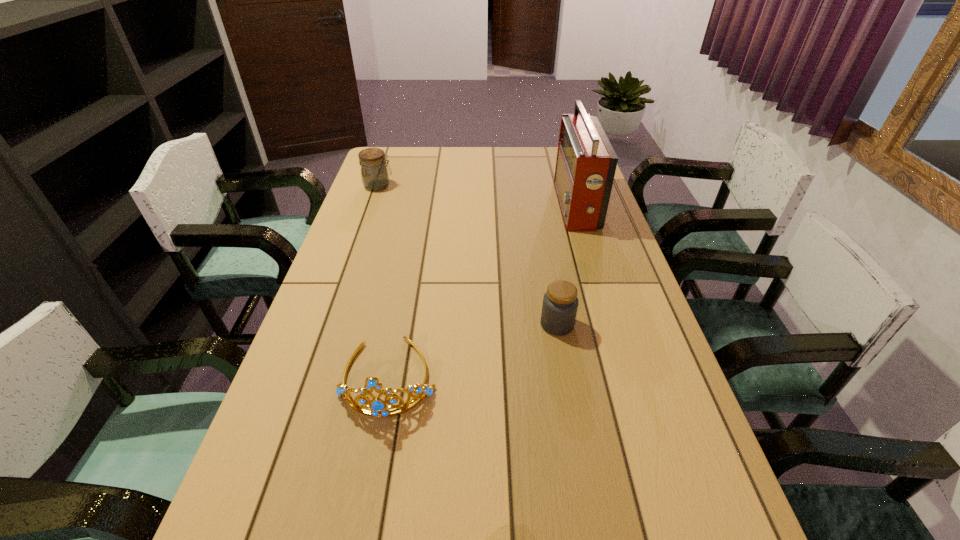
Image resolution: width=960 pixels, height=540 pixels. In order to click on vacant position in the image that satisfies the following two spatial constraints: 1. on the surface of the right jar near the warning symbol; 2. on the front-facing side of the third object from right to left in this screenshot , I will do `click(566, 376)`.

Where is `free space that satisfies the following two spatial constraints: 1. on the surface of the second nearest object near the warning symbol; 2. on the front-facing side of the nearest object`? The image size is (960, 540). free space that satisfies the following two spatial constraints: 1. on the surface of the second nearest object near the warning symbol; 2. on the front-facing side of the nearest object is located at coordinates (566, 376).